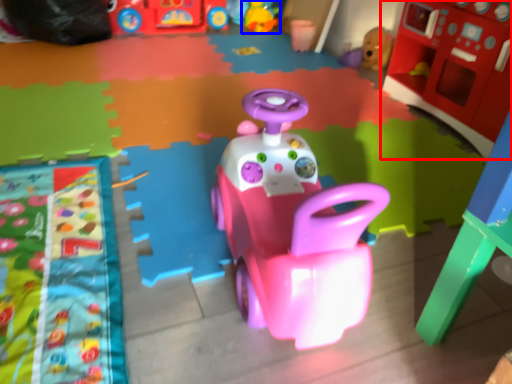
Question: Which of the following is the farthest to the observer, toy (highlighted by a red box) or toy (highlighted by a blue box)?

Choices:
 (A) toy
 (B) toy

Answer: (B)